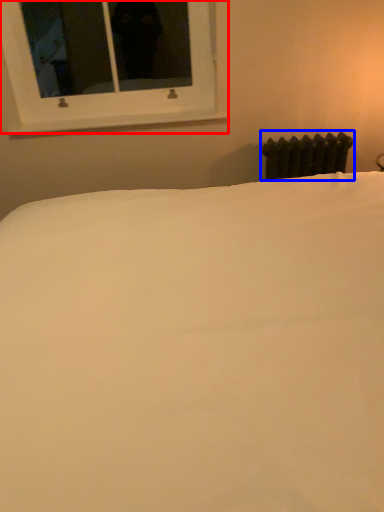
Question: Which of the following is the closest to the observer, window (highlighted by a red box) or radiator (highlighted by a blue box)?

Choices:
 (A) window
 (B) radiator

Answer: (A)